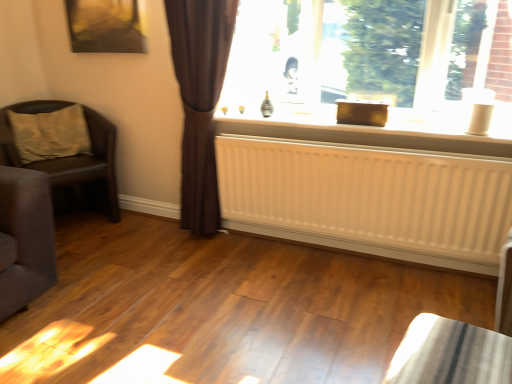
Question: Is metallic gold picture frame at upper left aimed at shiny metallic table at lower right?

Choices:
 (A) no
 (B) yes

Answer: (A)

Question: From a real-world perspective, is metallic gold picture frame at upper left located higher than shiny metallic table at lower right?

Choices:
 (A) yes
 (B) no

Answer: (A)

Question: Is metallic gold picture frame at upper left surrounding shiny metallic table at lower right?

Choices:
 (A) yes
 (B) no

Answer: (B)

Question: Would you say metallic gold picture frame at upper left is a long distance from shiny metallic table at lower right?

Choices:
 (A) yes
 (B) no

Answer: (A)

Question: From a real-world perspective, is metallic gold picture frame at upper left below shiny metallic table at lower right?

Choices:
 (A) yes
 (B) no

Answer: (B)

Question: From the image's perspective, is brown leather chair at left positioned above or below brown sheer curtain at left?

Choices:
 (A) below
 (B) above

Answer: (A)

Question: From a real-world perspective, is brown leather chair at left positioned above or below brown sheer curtain at left?

Choices:
 (A) above
 (B) below

Answer: (B)

Question: In the image, is brown leather chair at left positioned in front of or behind brown sheer curtain at left?

Choices:
 (A) front
 (B) behind

Answer: (B)

Question: Considering the positions of brown leather chair at left and brown sheer curtain at left in the image, is brown leather chair at left wider or thinner than brown sheer curtain at left?

Choices:
 (A) thin
 (B) wide

Answer: (B)

Question: Does point (69, 203) appear closer or farther from the camera than point (74, 6)?

Choices:
 (A) closer
 (B) farther

Answer: (B)

Question: From the image's perspective, relative to metallic gold picture frame at upper left, is brown leather chair at left above or below?

Choices:
 (A) above
 (B) below

Answer: (B)

Question: Based on their positions, is brown leather chair at left located to the left or right of metallic gold picture frame at upper left?

Choices:
 (A) left
 (B) right

Answer: (A)

Question: Looking at their shapes, would you say brown leather chair at left is wider or thinner than metallic gold picture frame at upper left?

Choices:
 (A) wide
 (B) thin

Answer: (A)

Question: From their relative heights in the image, would you say shiny metallic table at lower right is taller or shorter than beige fabric pillow at left?

Choices:
 (A) tall
 (B) short

Answer: (B)

Question: Is shiny metallic table at lower right bigger or smaller than beige fabric pillow at left?

Choices:
 (A) small
 (B) big

Answer: (B)